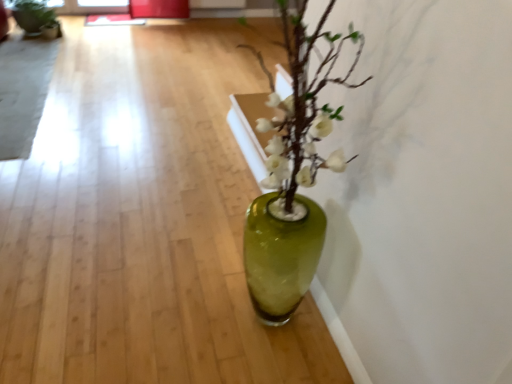
Question: From a real-world perspective, is green glass vase at center on matte black pot at upper left?

Choices:
 (A) yes
 (B) no

Answer: (B)

Question: Is green glass vase at center surrounding matte black pot at upper left?

Choices:
 (A) yes
 (B) no

Answer: (B)

Question: Considering the relative sizes of green glass vase at center and matte black pot at upper left in the image provided, is green glass vase at center thinner than matte black pot at upper left?

Choices:
 (A) yes
 (B) no

Answer: (A)

Question: Is green glass vase at center shorter than matte black pot at upper left?

Choices:
 (A) no
 (B) yes

Answer: (B)

Question: Is green glass vase at center smaller than matte black pot at upper left?

Choices:
 (A) yes
 (B) no

Answer: (A)

Question: Relative to translucent glass vase at center, is green glass vase at center in front or behind?

Choices:
 (A) front
 (B) behind

Answer: (A)

Question: In terms of height, does green glass vase at center look taller or shorter compared to translucent glass vase at center?

Choices:
 (A) tall
 (B) short

Answer: (B)

Question: Considering the positions of green glass vase at center and translucent glass vase at center in the image, is green glass vase at center wider or thinner than translucent glass vase at center?

Choices:
 (A) thin
 (B) wide

Answer: (A)

Question: Based on their positions, is green glass vase at center located to the left or right of translucent glass vase at center?

Choices:
 (A) left
 (B) right

Answer: (A)

Question: Would you say translucent glass vase at center is inside or outside matte black pot at upper left?

Choices:
 (A) outside
 (B) inside

Answer: (A)

Question: Is translucent glass vase at center wider or thinner than matte black pot at upper left?

Choices:
 (A) wide
 (B) thin

Answer: (B)

Question: Is point (305, 134) closer or farther from the camera than point (49, 26)?

Choices:
 (A) farther
 (B) closer

Answer: (B)

Question: Based on their sizes in the image, would you say translucent glass vase at center is bigger or smaller than matte black pot at upper left?

Choices:
 (A) big
 (B) small

Answer: (A)

Question: Would you say matte black pot at upper left is inside or outside translucent glass vase at center?

Choices:
 (A) inside
 (B) outside

Answer: (B)

Question: Does point (12, 8) appear closer or farther from the camera than point (290, 99)?

Choices:
 (A) farther
 (B) closer

Answer: (A)